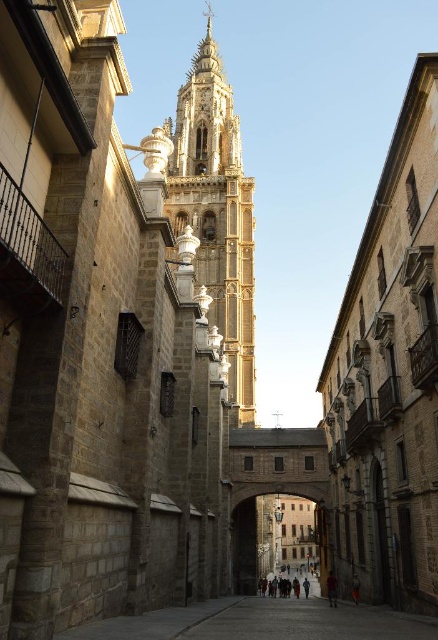
From the picture: You are a tourist standing on the small bridge in the narrow street. You notice the smooth stone church at center and the dark red fabric at center. Which object is wider from your perspective?

The dark red fabric at center is wider than the smooth stone church at center from your perspective.

From the picture: You are a tourist standing on the small bridge in the narrow street. You see the smooth stone church at center and the dark red fabric at center. Which object is positioned to the right of the other?

The smooth stone church at center is to the right of the dark red fabric at center.